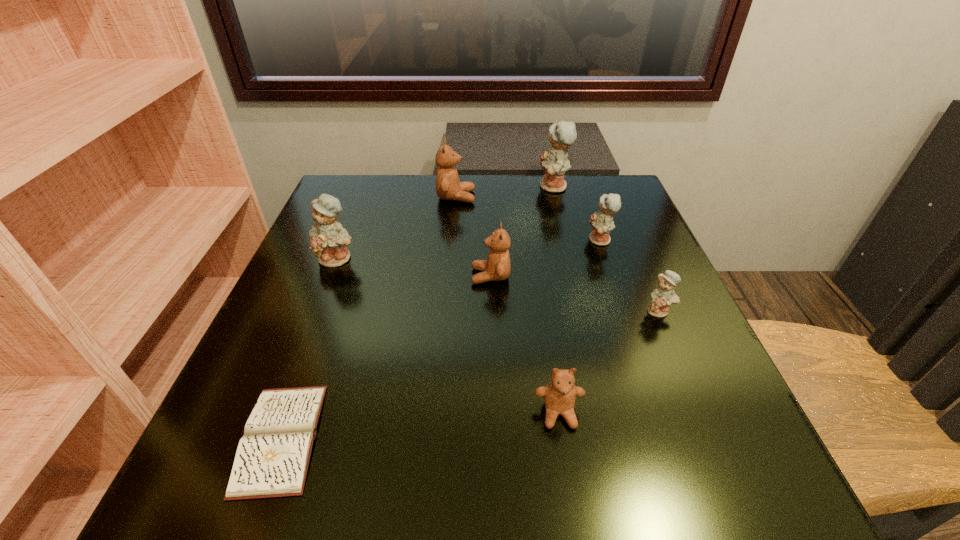
Identify the location of free spot located on the front-facing side of the third biggest blue teddy bear. The height and width of the screenshot is (540, 960). (450, 240).

I want to click on free spot located 0.090m on the face of the second smallest brown teddy bear, so click(x=427, y=276).

Where is `vacant space positioned 0.210m on the face of the second smallest brown teddy bear`? The width and height of the screenshot is (960, 540). vacant space positioned 0.210m on the face of the second smallest brown teddy bear is located at coordinates (369, 276).

The image size is (960, 540). I want to click on vacant area situated on the face of the second smallest brown teddy bear, so click(x=408, y=276).

In order to click on vacant space situated 0.200m on the front-facing side of the rightmost blue teddy bear in this screenshot , I will do `click(704, 416)`.

Where is `vacant area situated 0.060m on the face of the smallest brown teddy bear`? This screenshot has height=540, width=960. vacant area situated 0.060m on the face of the smallest brown teddy bear is located at coordinates (567, 472).

You are a GUI agent. You are given a task and a screenshot of the screen. Output one action in this format:
    pyautogui.click(x=<x>, y=<y>)
    Task: Click on the vacant position located 0.400m on the back of the shortest object
    This screenshot has width=960, height=540.
    Given the screenshot: What is the action you would take?
    pyautogui.click(x=354, y=238)

Image resolution: width=960 pixels, height=540 pixels. I want to click on object at the near edge, so click(x=272, y=458).

You are a GUI agent. You are given a task and a screenshot of the screen. Output one action in this format:
    pyautogui.click(x=<x>, y=<y>)
    Task: Click on the teddy bear located in the left edge section of the desktop
    The width and height of the screenshot is (960, 540).
    Given the screenshot: What is the action you would take?
    pyautogui.click(x=328, y=239)

Locate an element on the screen. The image size is (960, 540). diary at the left edge is located at coordinates (272, 458).